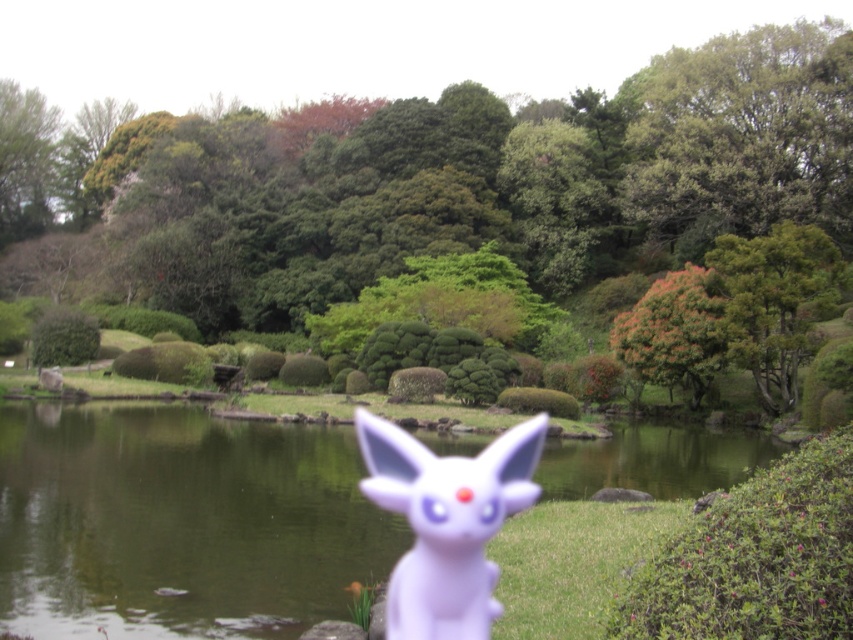
Does green leafy tree at upper center appear over orange-brown textured tree at center-right?

Yes, green leafy tree at upper center is above orange-brown textured tree at center-right.

Is green leafy tree at upper center further to camera compared to orange-brown textured tree at center-right?

Yes.

This screenshot has width=853, height=640. Describe the element at coordinates (491, 180) in the screenshot. I see `green leafy tree at upper center` at that location.

Identify the location of green leafy tree at upper center. (491, 180).

Who is higher up, transparent plastic water at center or purple matte rabbit at center?

purple matte rabbit at center

Is point (381, 538) positioned after point (442, 467)?

Yes, point (381, 538) is behind point (442, 467).

Identify the location of transparent plastic water at center. The height and width of the screenshot is (640, 853). (178, 522).

In the scene shown: Between green leafy tree at upper center and purple matte rabbit at center, which one is positioned higher?

Positioned higher is green leafy tree at upper center.

Can you confirm if green leafy tree at upper center is shorter than purple matte rabbit at center?

Incorrect, green leafy tree at upper center's height does not fall short of purple matte rabbit at center's.

At what (x,y) coordinates should I click in order to perform the action: click on green leafy tree at upper center. Please return your answer as a coordinate pair (x, y). Looking at the image, I should click on (491, 180).